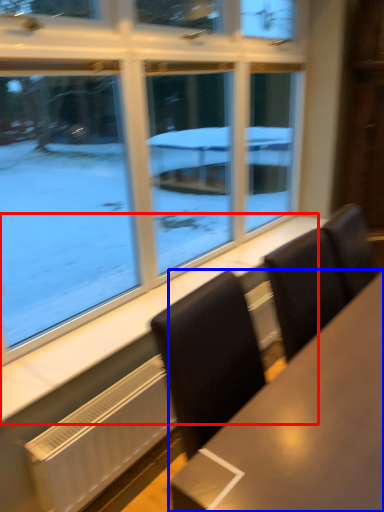
Question: Which point is further to the camera, window sill (highlighted by a red box) or table (highlighted by a blue box)?

Choices:
 (A) window sill
 (B) table

Answer: (A)